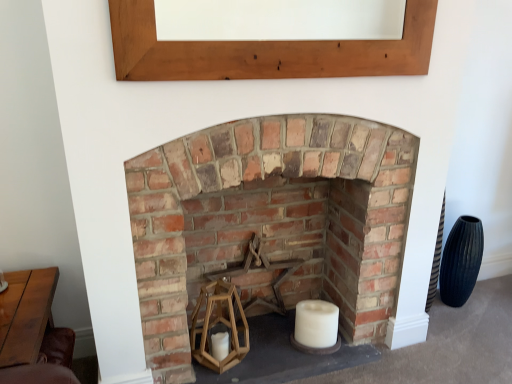
Question: Is wooden table at lower left not inside rustic brick fireplace at center?

Choices:
 (A) no
 (B) yes

Answer: (B)

Question: Is wooden table at lower left surrounding rustic brick fireplace at center?

Choices:
 (A) yes
 (B) no

Answer: (B)

Question: From a real-world perspective, is wooden table at lower left physically above rustic brick fireplace at center?

Choices:
 (A) yes
 (B) no

Answer: (B)

Question: From the image's perspective, would you say wooden table at lower left is positioned over rustic brick fireplace at center?

Choices:
 (A) yes
 (B) no

Answer: (B)

Question: Would you say wooden table at lower left is a long distance from rustic brick fireplace at center?

Choices:
 (A) no
 (B) yes

Answer: (A)

Question: Is the depth of wooden table at lower left less than that of rustic brick fireplace at center?

Choices:
 (A) yes
 (B) no

Answer: (A)

Question: Is wooden at center facing away from light brown wood at upper center?

Choices:
 (A) yes
 (B) no

Answer: (B)

Question: Is wooden at center thinner than light brown wood at upper center?

Choices:
 (A) no
 (B) yes

Answer: (A)

Question: Is the position of wooden at center less distant than that of light brown wood at upper center?

Choices:
 (A) no
 (B) yes

Answer: (A)

Question: Is wooden at center to the left of light brown wood at upper center from the viewer's perspective?

Choices:
 (A) no
 (B) yes

Answer: (B)

Question: Is wooden at center taller than light brown wood at upper center?

Choices:
 (A) yes
 (B) no

Answer: (A)

Question: Is wooden at center far from light brown wood at upper center?

Choices:
 (A) yes
 (B) no

Answer: (A)

Question: Does wooden at center turn towards white matte candle at center?

Choices:
 (A) yes
 (B) no

Answer: (A)